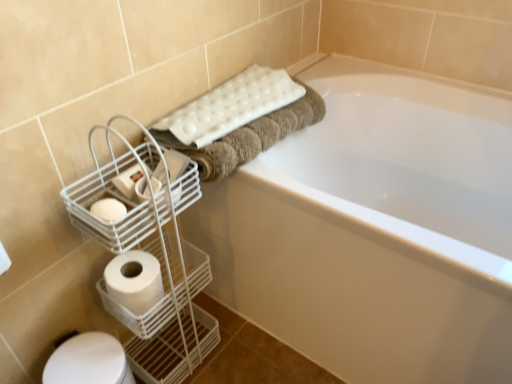
The width and height of the screenshot is (512, 384). In order to click on empty space that is ontop of white textured bath towel at upper center (from a real-world perspective) in this screenshot , I will do `click(216, 105)`.